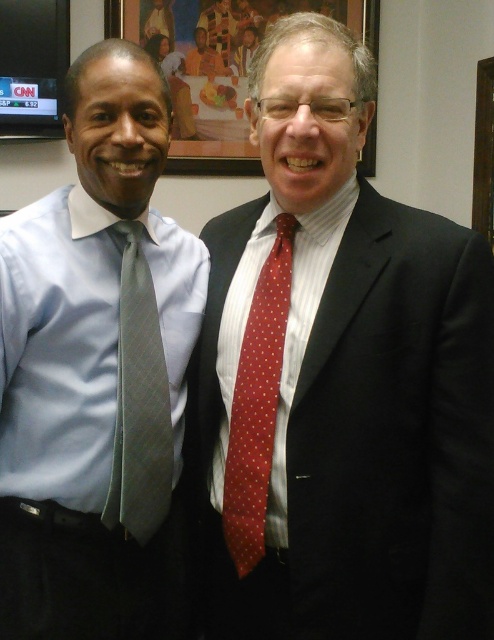
You are a photographer adjusting the camera focus. You need to decide which object to focus on first between the red dotted tie at center and the wooden picture frame at upper center. Which one should you choose if you want to focus on the smaller object?

The red dotted tie at center occupies less space than the wooden picture frame at upper center, so you should focus on the red dotted tie at center first since it is smaller.

You are a photographer adjusting the camera settings to capture a clear photo of both the gray textured tie at left and the red dotted tie at right. The camera has a depth of field that can focus on objects within a 5 inch range. Will you be able to capture both ties in focus?

The gray textured tie at left and red dotted tie at right are 6.07 inches apart from each other. Since the depth of field can only focus on objects within a 5 inch range, the distance between them exceeds this limit. Therefore, both ties cannot be in focus simultaneously.

You are organizing a formal event and need to ensure that the matte gray tie at left and the gray textured tie at left are displayed side by side on a narrow rack. Given their widths, which tie should be placed on the left side to prevent overcrowding?

The matte gray tie at left should be placed on the left side because its width is larger than the gray textured tie at left, allowing more space between them on the narrow rack.